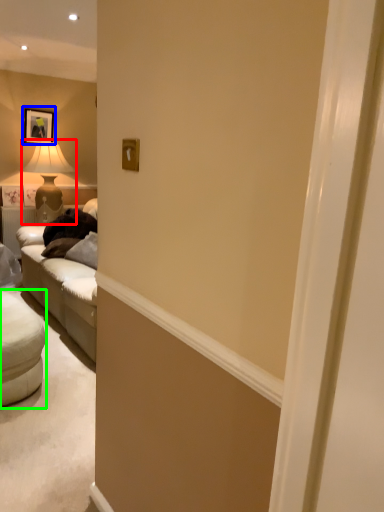
Question: Based on their relative distances, which object is farther from table lamp (highlighted by a red box)? Choose from picture frame (highlighted by a blue box) and studio couch (highlighted by a green box).

Choices:
 (A) picture frame
 (B) studio couch

Answer: (B)